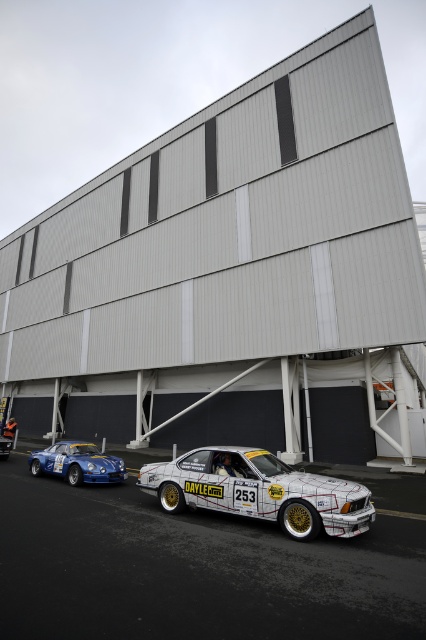
Question: Based on their relative distances, which object is farther from the gray metallic building at center?

Choices:
 (A) blue metallic car at lower left
 (B) white painted asphalt at lower center

Answer: (A)

Question: From the image, what is the correct spatial relationship of white/striped/panel car at center in relation to blue metallic car at lower left?

Choices:
 (A) left
 (B) right

Answer: (B)

Question: Based on their relative distances, which object is nearer to the white painted asphalt at lower center?

Choices:
 (A) blue metallic car at lower left
 (B) gray metallic building at center
 (C) white/striped/panel car at center

Answer: (C)

Question: Which point is closer to the camera?

Choices:
 (A) white painted asphalt at lower center
 (B) blue metallic car at lower left
 (C) white/striped/panel car at center

Answer: (A)

Question: Can you confirm if white painted asphalt at lower center is positioned above white/striped/panel car at center?

Choices:
 (A) no
 (B) yes

Answer: (A)

Question: Does white painted asphalt at lower center lie behind blue metallic car at lower left?

Choices:
 (A) no
 (B) yes

Answer: (A)